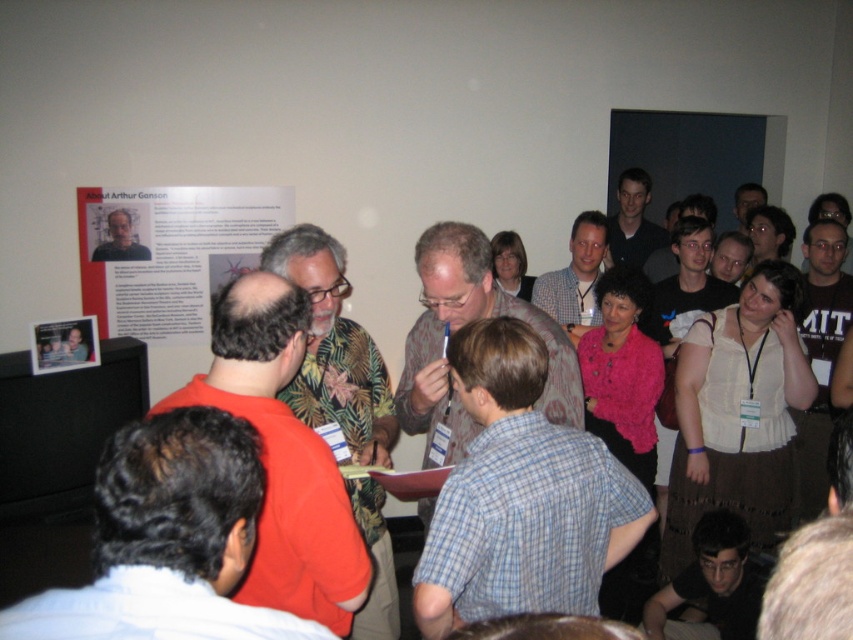
Question: Does orange shirt at center appear on the right side of green floral shirt at center?

Choices:
 (A) no
 (B) yes

Answer: (A)

Question: Is plaid shirt at center to the right of matte black shirt at upper center from the viewer's perspective?

Choices:
 (A) yes
 (B) no

Answer: (B)

Question: Which object appears farthest from the camera in this image?

Choices:
 (A) blue plaid shirt at center
 (B) matte black photo frame at upper left
 (C) matte gray shirt at center
 (D) dark brown hair at center

Answer: (C)

Question: Which of the following is the closest to the observer?

Choices:
 (A) (456, 440)
 (B) (608, 244)

Answer: (A)

Question: Which object is positioned closest to the dark brown hair at lower right?

Choices:
 (A) matte black shirt at center
 (B) blue plaid shirt at center
 (C) green floral shirt at center

Answer: (C)

Question: Can you confirm if orange shirt at center is wider than matte paper poster at upper left?

Choices:
 (A) yes
 (B) no

Answer: (B)